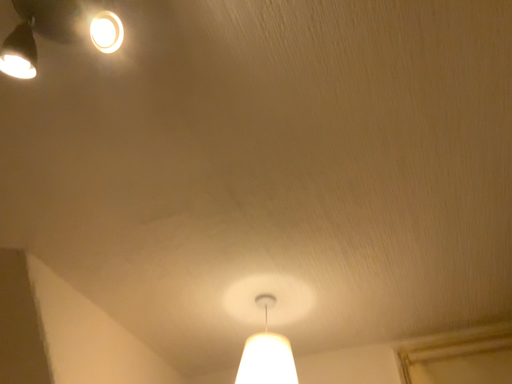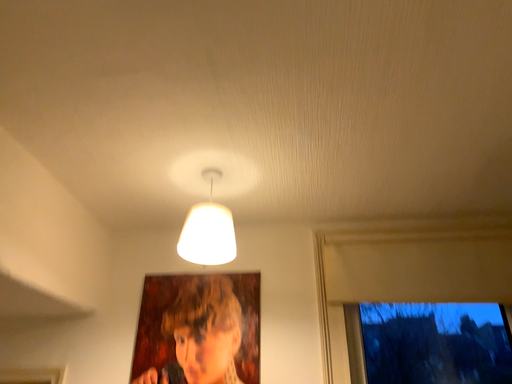
Question: Which way did the camera rotate in the video?

Choices:
 (A) rotated right
 (B) rotated left

Answer: (A)